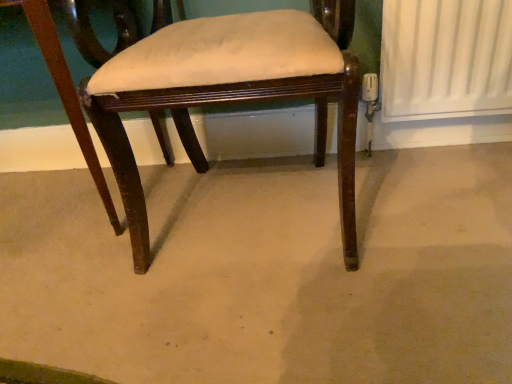
The height and width of the screenshot is (384, 512). Describe the element at coordinates (269, 273) in the screenshot. I see `brown wood chair at center` at that location.

In order to face brown wood chair at center, should I rotate leftwards or rightwards?

Rotate your view left by about 3.657°.

Image resolution: width=512 pixels, height=384 pixels. Find the location of `brown wood chair at center`. brown wood chair at center is located at coordinates (269, 273).

This screenshot has width=512, height=384. Describe the element at coordinates (218, 89) in the screenshot. I see `mahogany wood chair at center` at that location.

Image resolution: width=512 pixels, height=384 pixels. I want to click on mahogany wood chair at center, so click(218, 89).

This screenshot has width=512, height=384. What are the coordinates of `brown wood chair at center` in the screenshot? It's located at (269, 273).

Can you confirm if mahogany wood chair at center is positioned to the right of brown wood chair at center?

Yes.

Considering their positions, is mahogany wood chair at center located in front of or behind brown wood chair at center?

mahogany wood chair at center is positioned farther from the viewer than brown wood chair at center.

Does point (181, 125) come behind point (430, 151)?

No, it is not.

From the image's perspective, between mahogany wood chair at center and brown wood chair at center, who is located below?

brown wood chair at center appears lower in the image.

From a real-world perspective, which object rests below the other?

In real-world perspective, brown wood chair at center is lower.

Which of these two, mahogany wood chair at center or brown wood chair at center, is wider?

With larger width is brown wood chair at center.

Considering the sizes of objects mahogany wood chair at center and brown wood chair at center in the image provided, who is taller, mahogany wood chair at center or brown wood chair at center?

mahogany wood chair at center is taller.

In the scene shown: Considering the sizes of mahogany wood chair at center and brown wood chair at center in the image, is mahogany wood chair at center bigger or smaller than brown wood chair at center?

In the image, mahogany wood chair at center appears to be larger than brown wood chair at center.

Is mahogany wood chair at center spatially inside brown wood chair at center, or outside of it?

mahogany wood chair at center is spatially situated outside brown wood chair at center.

Would you say mahogany wood chair at center is a long distance from brown wood chair at center?

mahogany wood chair at center is actually quite close to brown wood chair at center.

Based on the photo, does mahogany wood chair at center turn towards brown wood chair at center?

No, mahogany wood chair at center is not turned towards brown wood chair at center.

How different are the orientations of mahogany wood chair at center and brown wood chair at center in degrees?

The angle between the facing direction of mahogany wood chair at center and the facing direction of brown wood chair at center is 89.9 degrees.

What are the coordinates of `chair that is above the brown wood chair at center (from the image's perspective)` in the screenshot? It's located at (218, 89).

Is brown wood chair at center to the left or to the right of mahogany wood chair at center in the image?

Based on their positions, brown wood chair at center is located to the left of mahogany wood chair at center.

Considering the positions of objects brown wood chair at center and mahogany wood chair at center in the image provided, who is behind, brown wood chair at center or mahogany wood chair at center?

mahogany wood chair at center is further from the camera.

Is point (379, 234) positioned in front of point (97, 62)?

No, it is not.

From the image's perspective, which is above, brown wood chair at center or mahogany wood chair at center?

mahogany wood chair at center.

From a real-world perspective, is brown wood chair at center positioned above or below mahogany wood chair at center?

brown wood chair at center is below mahogany wood chair at center.

Considering the sizes of brown wood chair at center and mahogany wood chair at center in the image, is brown wood chair at center wider or thinner than mahogany wood chair at center?

In the image, brown wood chair at center appears to be wider than mahogany wood chair at center.

Does brown wood chair at center have a greater height compared to mahogany wood chair at center?

Incorrect, the height of brown wood chair at center is not larger of that of mahogany wood chair at center.

Between brown wood chair at center and mahogany wood chair at center, which one has larger size?

Bigger between the two is mahogany wood chair at center.

Based on the photo, is brown wood chair at center inside or outside of mahogany wood chair at center?

The correct answer is: outside.

Are brown wood chair at center and mahogany wood chair at center far apart?

Actually, brown wood chair at center and mahogany wood chair at center are a little close together.

Could you tell me if brown wood chair at center is turned towards mahogany wood chair at center?

No.

How different are the orientations of brown wood chair at center and mahogany wood chair at center in degrees?

The angle between the facing direction of brown wood chair at center and the facing direction of mahogany wood chair at center is 89.9 degrees.

This screenshot has height=384, width=512. Identify the location of chair located above the brown wood chair at center (from the image's perspective). (218, 89).

Where is `chair that is above the brown wood chair at center (from the image's perspective)`? Image resolution: width=512 pixels, height=384 pixels. chair that is above the brown wood chair at center (from the image's perspective) is located at coordinates (218, 89).

This screenshot has width=512, height=384. What are the coordinates of `concrete located underneath the mahogany wood chair at center (from a real-world perspective)` in the screenshot? It's located at (269, 273).